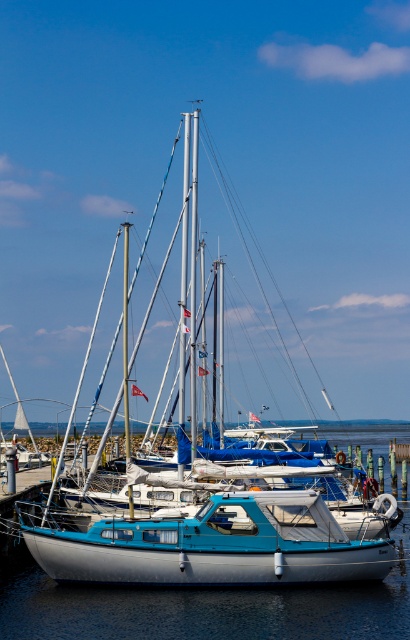
Is teal glossy sailboat at center above blue metallic water at center?

Indeed, teal glossy sailboat at center is positioned over blue metallic water at center.

Does teal glossy sailboat at center appear under blue metallic water at center?

Actually, teal glossy sailboat at center is above blue metallic water at center.

At what (x,y) coordinates should I click in order to perform the action: click on teal glossy sailboat at center. Please return your answer as a coordinate pair (x, y). The width and height of the screenshot is (410, 640). Looking at the image, I should click on (213, 545).

Find the location of a particular element. teal glossy sailboat at center is located at coordinates (213, 545).

Is blue matte sailboat at center thinner than teal glossy sailboat at center?

No, blue matte sailboat at center is not thinner than teal glossy sailboat at center.

Between point (287, 540) and point (252, 548), which one is positioned behind?

The point (287, 540) is more distant.

Image resolution: width=410 pixels, height=640 pixels. I want to click on blue matte sailboat at center, so click(x=205, y=540).

Does blue matte sailboat at center come in front of blue metallic water at center?

No, blue matte sailboat at center is further to the viewer.

Which is in front, point (225, 540) or point (72, 600)?

Point (72, 600) is more forward.

This screenshot has height=640, width=410. I want to click on blue matte sailboat at center, so click(x=205, y=540).